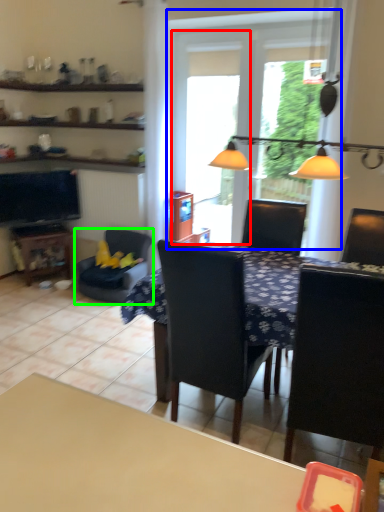
Question: Considering the real-world distances, which object is farthest from screen door (highlighted by a red box)? window (highlighted by a blue box) or chair (highlighted by a green box)?

Choices:
 (A) window
 (B) chair

Answer: (B)